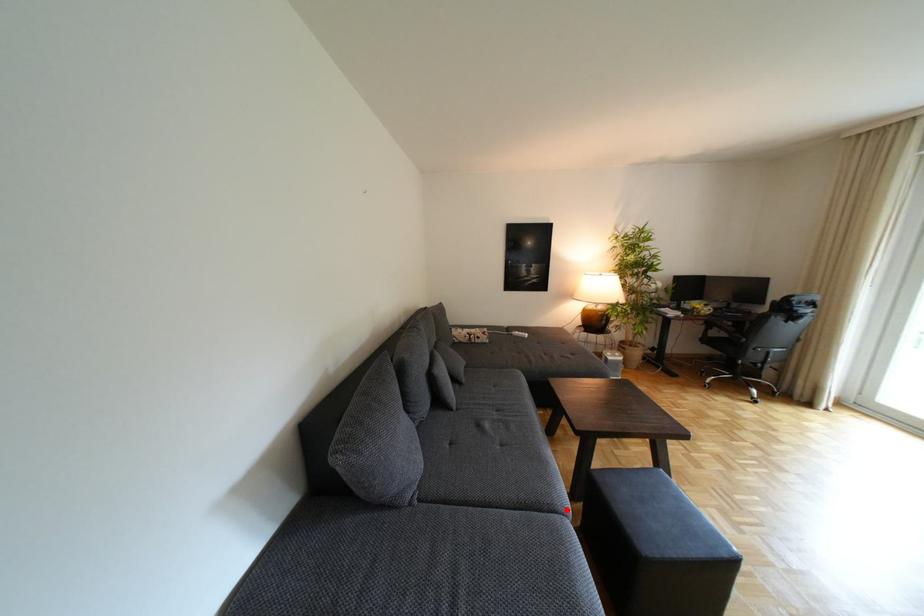
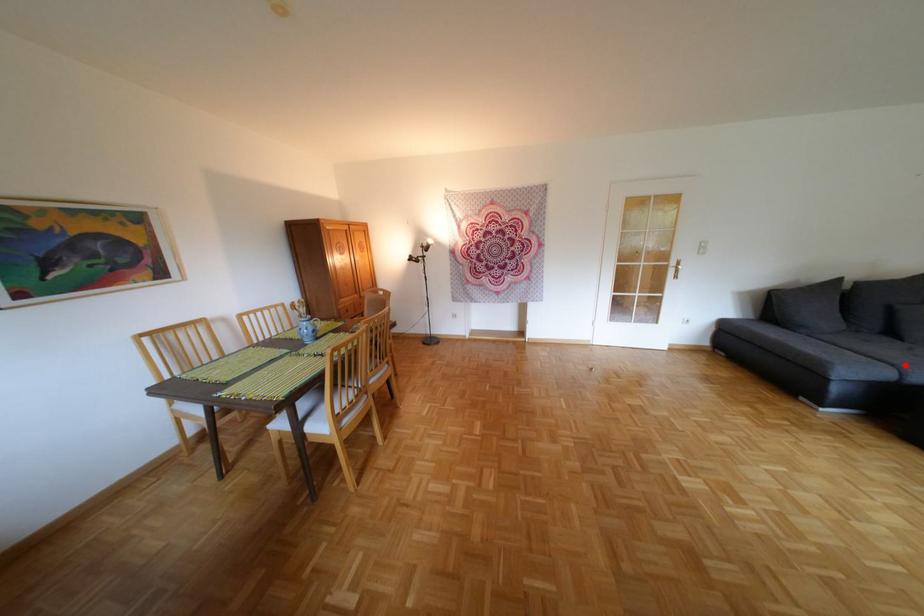
I am providing you with two images of the same scene from different viewpoints. A red point is marked on the first image and another point is marked on the second image. Are the points marked in image1 and image2 representing the same 3D position?

Yes